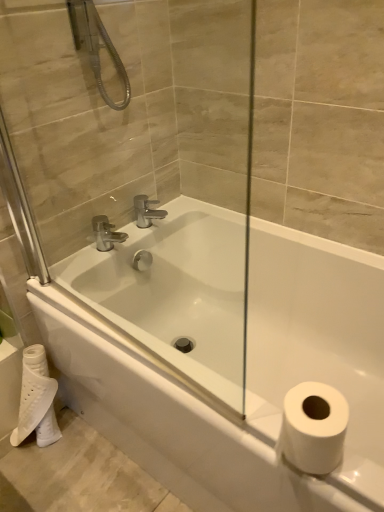
In order to click on polished chrome faucet at upper center in this screenshot , I will do `click(105, 233)`.

Where is `white matte toilet paper at lower left`? The height and width of the screenshot is (512, 384). white matte toilet paper at lower left is located at coordinates pyautogui.click(x=36, y=400).

What do you see at coordinates (140, 168) in the screenshot? The height and width of the screenshot is (512, 384). I see `transparent glass door at center` at bounding box center [140, 168].

Locate an element on the screen. transparent glass door at center is located at coordinates (140, 168).

Locate an element on the screen. The image size is (384, 512). polished chrome faucet at upper center is located at coordinates (105, 233).

Which point is more forward, (380, 401) or (92, 223)?

Positioned in front is point (380, 401).

Considering the positions of objects white glossy bathtub at center and polished chrome faucet at upper center in the image provided, who is more to the right, white glossy bathtub at center or polished chrome faucet at upper center?

From the viewer's perspective, white glossy bathtub at center appears more on the right side.

Can we say white glossy bathtub at center lies outside polished chrome faucet at upper center?

Absolutely, white glossy bathtub at center is external to polished chrome faucet at upper center.

Consider the image. Is the depth of white glossy bathtub at center less than that of polished chrome faucet at upper center?

Yes, white glossy bathtub at center is in front of polished chrome faucet at upper center.

From the image's perspective, relative to white matte toilet paper at lower left, is white glossy bathtub at center above or below?

Clearly, from the image's perspective, white glossy bathtub at center is above white matte toilet paper at lower left.

In the image, is white glossy bathtub at center positioned in front of or behind white matte toilet paper at lower left?

Clearly, white glossy bathtub at center is in front of white matte toilet paper at lower left.

Between white glossy bathtub at center and white matte toilet paper at lower left, which one has smaller size?

Smaller between the two is white matte toilet paper at lower left.

Can you tell me how much white glossy bathtub at center and white matte toilet paper at lower left differ in facing direction?

The angular difference between white glossy bathtub at center and white matte toilet paper at lower left is 89.1 degrees.

Are white matte toilet paper at lower left and polished chrome faucet at upper center making contact?

No, white matte toilet paper at lower left is not next to polished chrome faucet at upper center.

Considering the sizes of objects white matte toilet paper at lower left and polished chrome faucet at upper center in the image provided, who is thinner, white matte toilet paper at lower left or polished chrome faucet at upper center?

Thinner between the two is polished chrome faucet at upper center.

Is white matte toilet paper at lower left further to camera compared to polished chrome faucet at upper center?

No, white matte toilet paper at lower left is in front of polished chrome faucet at upper center.

Is white glossy bathtub at center turned away from transparent glass door at center?

No.

Considering the sizes of objects white glossy bathtub at center and transparent glass door at center in the image provided, who is wider, white glossy bathtub at center or transparent glass door at center?

white glossy bathtub at center is wider.

Looking at this image, from a real-world perspective, is white glossy bathtub at center physically located above or below transparent glass door at center?

white glossy bathtub at center is below transparent glass door at center.

Who is taller, white glossy bathtub at center or transparent glass door at center?

transparent glass door at center is taller.

Does white matte toilet paper at lower left appear on the left side of white glossy bathtub at center?

Indeed, white matte toilet paper at lower left is positioned on the left side of white glossy bathtub at center.

Which is less distant, (44, 362) or (195, 370)?

Point (44, 362) appears to be farther away from the viewer than point (195, 370).

Identify the location of bathtub above the white matte toilet paper at lower left (from a real-world perspective). The width and height of the screenshot is (384, 512). (223, 356).

Image resolution: width=384 pixels, height=512 pixels. Identify the location of tap above the white matte toilet paper at lower left (from a real-world perspective). (105, 233).

Between polished chrome faucet at upper center and white matte toilet paper at lower left, which one has smaller size?

polished chrome faucet at upper center is smaller.

Between polished chrome faucet at upper center and white matte toilet paper at lower left, which one is positioned in front?

Positioned in front is white matte toilet paper at lower left.

Can you confirm if transparent glass door at center is taller than polished chrome faucet at upper center?

Yes, transparent glass door at center is taller than polished chrome faucet at upper center.

Is transparent glass door at center closer to camera compared to polished chrome faucet at upper center?

Yes, the depth of transparent glass door at center is less than that of polished chrome faucet at upper center.

In the scene shown: Between transparent glass door at center and polished chrome faucet at upper center, which one has larger size?

Bigger between the two is transparent glass door at center.

Locate an element on the screen. bathtub located below the polished chrome faucet at upper center (from the image's perspective) is located at coordinates (223, 356).

This screenshot has width=384, height=512. I want to click on bathtub located on the right of white matte toilet paper at lower left, so click(223, 356).

Considering their positions, is polished chrome faucet at upper center positioned closer to transparent glass door at center than white matte toilet paper at lower left?

The object closer to transparent glass door at center is polished chrome faucet at upper center.

Based on their spatial positions, is polished chrome faucet at upper center or white matte toilet paper at lower left further from white glossy bathtub at center?

Among the two, polished chrome faucet at upper center is located further to white glossy bathtub at center.

Considering their positions, is white matte toilet paper at lower left positioned closer to transparent glass door at center than white glossy bathtub at center?

The object closer to transparent glass door at center is white glossy bathtub at center.

Considering their positions, is polished chrome faucet at upper center positioned closer to white glossy bathtub at center than transparent glass door at center?

Among the two, transparent glass door at center is located nearer to white glossy bathtub at center.

Looking at the image, which one is located further to white matte toilet paper at lower left, white glossy bathtub at center or polished chrome faucet at upper center?

polished chrome faucet at upper center is positioned further to the anchor white matte toilet paper at lower left.

When comparing their distances from transparent glass door at center, does white matte toilet paper at lower left or polished chrome faucet at upper center seem further?

white matte toilet paper at lower left is positioned further to the anchor transparent glass door at center.

Looking at the image, which one is located further to transparent glass door at center, white glossy bathtub at center or white matte toilet paper at lower left?

white matte toilet paper at lower left lies further to transparent glass door at center than the other object.

Based on their spatial positions, is white glossy bathtub at center or transparent glass door at center closer to polished chrome faucet at upper center?

The object closer to polished chrome faucet at upper center is transparent glass door at center.

Find the location of `toilet paper located between white glossy bathtub at center and polished chrome faucet at upper center in the depth direction`. toilet paper located between white glossy bathtub at center and polished chrome faucet at upper center in the depth direction is located at coordinates click(x=36, y=400).

The width and height of the screenshot is (384, 512). I want to click on bathtub located between transparent glass door at center and polished chrome faucet at upper center in the depth direction, so click(x=223, y=356).

The width and height of the screenshot is (384, 512). I want to click on toilet paper between transparent glass door at center and polished chrome faucet at upper center along the z-axis, so click(x=36, y=400).

Where is `bathtub between transparent glass door at center and white matte toilet paper at lower left from front to back`? This screenshot has height=512, width=384. bathtub between transparent glass door at center and white matte toilet paper at lower left from front to back is located at coordinates (223, 356).